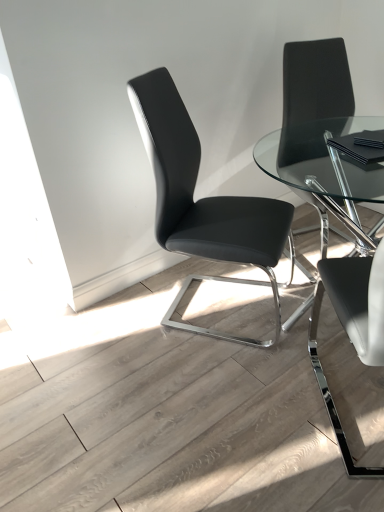
You are a GUI agent. You are given a task and a screenshot of the screen. Output one action in this format:
    pyautogui.click(x=<x>, y=<y>)
    Task: Click on the free location in front of black leather chair at center, which ranks as the 1th chair in left-to-right order
    This screenshot has width=384, height=512.
    Given the screenshot: What is the action you would take?
    pyautogui.click(x=215, y=384)